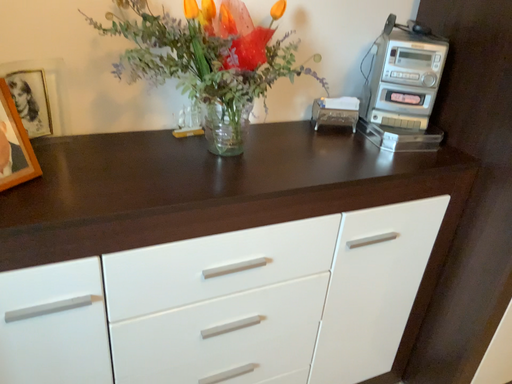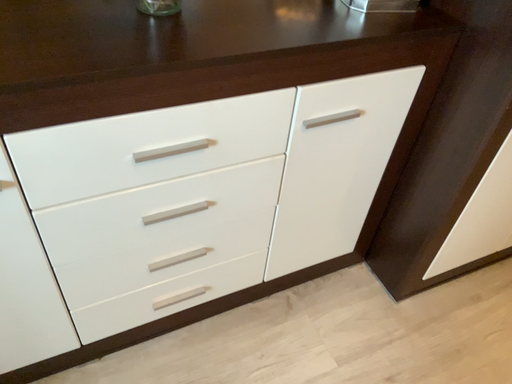
Question: Which way did the camera rotate in the video?

Choices:
 (A) rotated downward
 (B) rotated upward

Answer: (A)